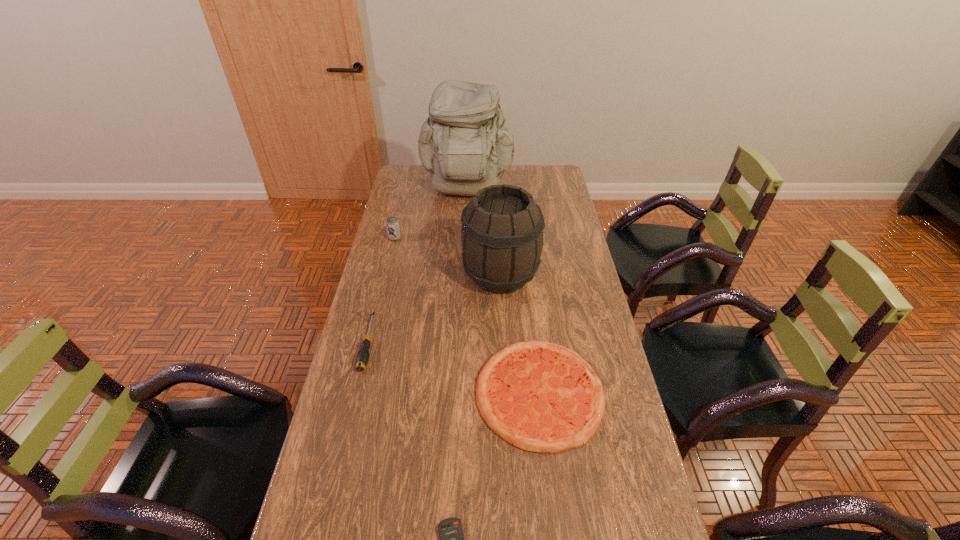
I want to click on vacant space at the left edge of the desktop, so pos(399,190).

Locate an element on the screen. The image size is (960, 540). free space at the right edge of the desktop is located at coordinates [553, 269].

Where is `vacant space at the far right corner of the desktop`? vacant space at the far right corner of the desktop is located at coordinates (542, 174).

You are a GUI agent. You are given a task and a screenshot of the screen. Output one action in this format:
    pyautogui.click(x=<x>, y=<y>)
    Task: Click on the free spot between the fourth tallest object and the fourth nearest object
    The height and width of the screenshot is (540, 960).
    Given the screenshot: What is the action you would take?
    pyautogui.click(x=434, y=309)

You are a GUI agent. You are given a task and a screenshot of the screen. Output one action in this format:
    pyautogui.click(x=<x>, y=<y>)
    Task: Click on the free spot between the screwdriver and the backpack
    This screenshot has height=540, width=960.
    Given the screenshot: What is the action you would take?
    pyautogui.click(x=418, y=267)

Find the location of `free space between the fourth shortest object and the fourth tallest object`. free space between the fourth shortest object and the fourth tallest object is located at coordinates (381, 291).

Find the location of a particular element. free space between the beer can and the backpack is located at coordinates click(431, 215).

This screenshot has height=540, width=960. What are the coordinates of `empty space that is in between the screwdriver and the farthest object` in the screenshot? It's located at (418, 267).

You are a GUI agent. You are given a task and a screenshot of the screen. Output one action in this format:
    pyautogui.click(x=<x>, y=<y>)
    Task: Click on the free spot between the fifth nearest object and the farthest object
    
    Given the screenshot: What is the action you would take?
    pyautogui.click(x=431, y=215)

Locate an element on the screen. This screenshot has width=960, height=540. free point between the backpack and the third tallest object is located at coordinates (431, 215).